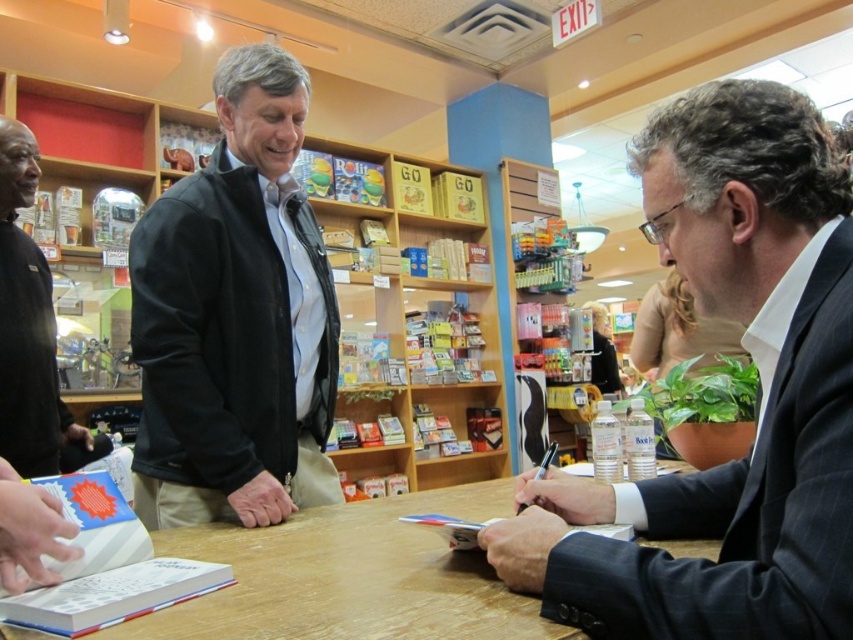
Question: Among these points, which one is farthest from the camera?

Choices:
 (A) (13, 332)
 (B) (404, 570)

Answer: (A)

Question: Can you confirm if black leather jacket at center is positioned above black matte shirt at left?

Choices:
 (A) no
 (B) yes

Answer: (A)

Question: Is dark suit at right to the left of black leather jacket at center from the viewer's perspective?

Choices:
 (A) no
 (B) yes

Answer: (A)

Question: Which point is farther to the camera?

Choices:
 (A) (x=490, y=604)
 (B) (x=201, y=337)
 (C) (x=28, y=145)

Answer: (C)

Question: Can you confirm if black leather jacket at center is bigger than wooden table at center?

Choices:
 (A) yes
 (B) no

Answer: (A)

Question: Which object is positioned closest to the dark suit at right?

Choices:
 (A) black leather jacket at center
 (B) wooden bookshelf at center
 (C) wooden table at center

Answer: (C)